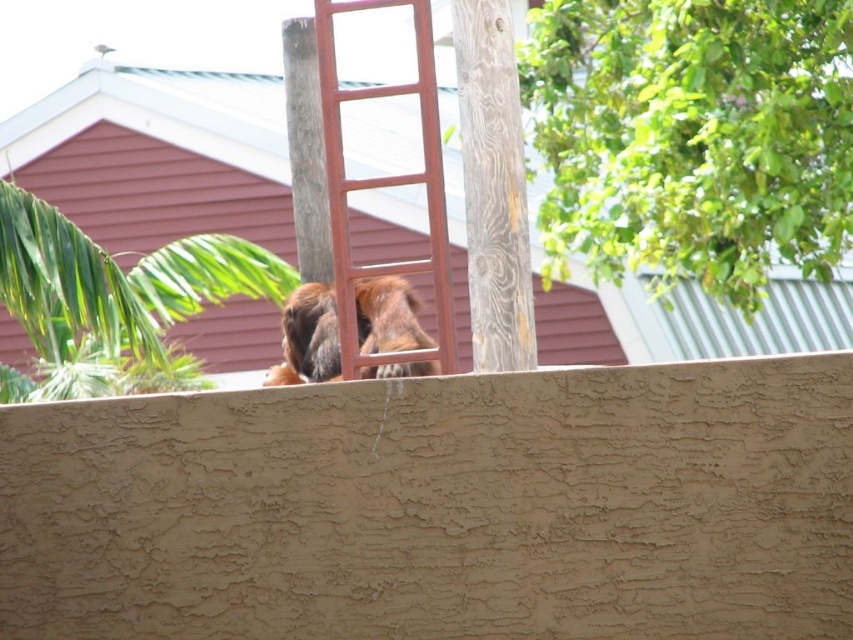
You are standing in front of the beige wall and want to place a small plant pot between the two points labeled point (602, 188) and point (381, 333). Which point is closer to you so that you can place the pot there first?

Point (602, 188) is further to the viewer than point (381, 333), so point (381, 333) is closer to you. You should place the pot near point (381, 333) first.

In the scene shown: You are a painter who needs to climb the ladder to reach the upper right corner of the wall. The ladder is currently leaning against two wooden posts. Considering the green leafy tree at upper right and the brown furry dog at center, which object is bigger in size?

The green leafy tree at upper right is larger in size compared to the brown furry dog at center, so the tree is bigger.